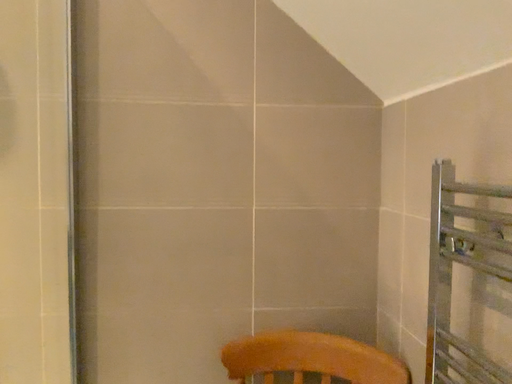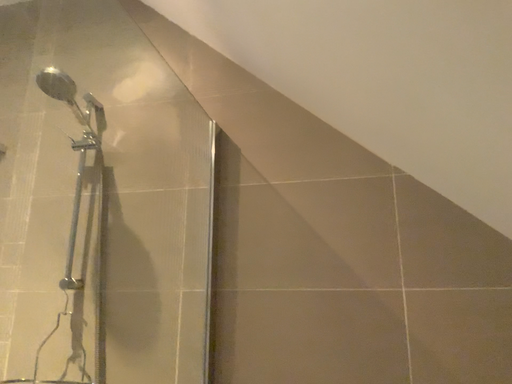
Question: How did the camera likely rotate when shooting the video?

Choices:
 (A) rotated downward
 (B) rotated upward

Answer: (B)